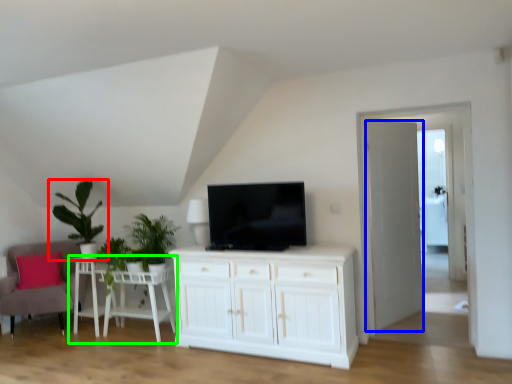
Question: Which object is the farthest from houseplant (highlighted by a red box)? Choose among these: door (highlighted by a blue box) or table (highlighted by a green box).

Choices:
 (A) door
 (B) table

Answer: (A)